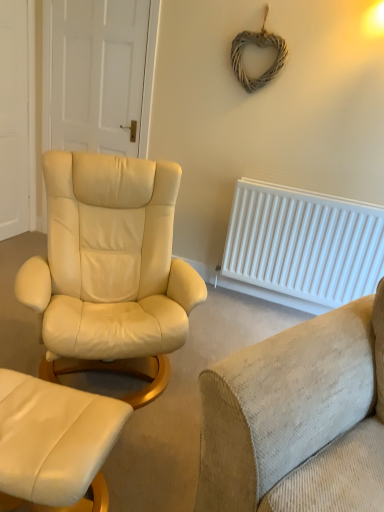
Question: Would you say white wooden door at left, acting as the second door starting from the right, is part of white matte door at upper left, arranged as the second door when viewed from the left,'s contents?

Choices:
 (A) yes
 (B) no

Answer: (B)

Question: From a real-world perspective, is white matte door at upper left, which is the 1th door in right-to-left order, positioned under white wooden door at left, the first door from the left, based on gravity?

Choices:
 (A) no
 (B) yes

Answer: (A)

Question: Does white matte door at upper left, which is the 1th door in right-to-left order, have a lesser width compared to white wooden door at left, acting as the second door starting from the right?

Choices:
 (A) yes
 (B) no

Answer: (A)

Question: Does white matte door at upper left, arranged as the second door when viewed from the left, have a greater height compared to white wooden door at left, acting as the second door starting from the right?

Choices:
 (A) yes
 (B) no

Answer: (B)

Question: Does white matte door at upper left, which is the 1th door in right-to-left order, have a lesser height compared to white wooden door at left, acting as the second door starting from the right?

Choices:
 (A) yes
 (B) no

Answer: (A)

Question: From the image's perspective, relative to beige corduroy couch at lower right, is white plastic radiator at right above or below?

Choices:
 (A) below
 (B) above

Answer: (B)

Question: In terms of size, does white plastic radiator at right appear bigger or smaller than beige corduroy couch at lower right?

Choices:
 (A) big
 (B) small

Answer: (B)

Question: In terms of width, does white plastic radiator at right look wider or thinner when compared to beige corduroy couch at lower right?

Choices:
 (A) thin
 (B) wide

Answer: (A)

Question: Based on their positions, is white plastic radiator at right located to the left or right of beige corduroy couch at lower right?

Choices:
 (A) right
 (B) left

Answer: (A)

Question: Is white matte door at upper left, which is the 1th door in right-to-left order, inside or outside of white wooden door at left, the first door from the left?

Choices:
 (A) inside
 (B) outside

Answer: (B)

Question: Considering the positions of white matte door at upper left, arranged as the second door when viewed from the left, and white wooden door at left, acting as the second door starting from the right, in the image, is white matte door at upper left, arranged as the second door when viewed from the left, wider or thinner than white wooden door at left, acting as the second door starting from the right,?

Choices:
 (A) wide
 (B) thin

Answer: (B)

Question: From the image's perspective, is white matte door at upper left, arranged as the second door when viewed from the left, above or below white wooden door at left, the first door from the left?

Choices:
 (A) above
 (B) below

Answer: (A)

Question: From their relative heights in the image, would you say white matte door at upper left, which is the 1th door in right-to-left order, is taller or shorter than white wooden door at left, the first door from the left?

Choices:
 (A) short
 (B) tall

Answer: (A)

Question: Relative to white matte door at upper left, arranged as the second door when viewed from the left, is matte cream leather ottoman at lower left in front or behind?

Choices:
 (A) front
 (B) behind

Answer: (A)

Question: Is matte cream leather ottoman at lower left inside or outside of white matte door at upper left, which is the 1th door in right-to-left order?

Choices:
 (A) outside
 (B) inside

Answer: (A)